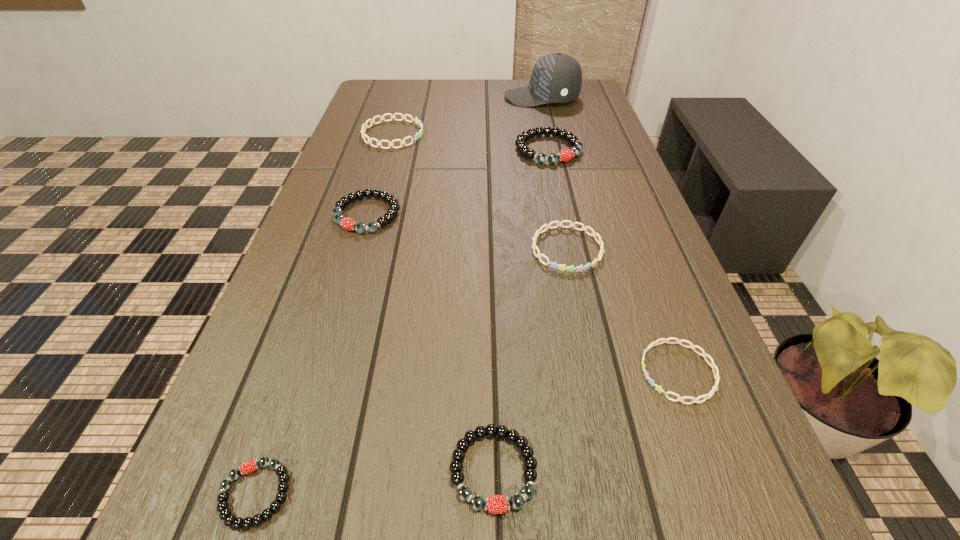
At what (x,y) coordinates should I click in order to perform the action: click on vacant space situated on the surface of the second blue bracelet from right to left showing star-shaped elements. Please return your answer as a coordinate pair (x, y). The width and height of the screenshot is (960, 540). Looking at the image, I should click on (599, 401).

At what (x,y) coordinates should I click in order to perform the action: click on free space located 0.270m on the back of the fourth bracelet from left to right. Please return your answer as a coordinate pair (x, y). The height and width of the screenshot is (540, 960). Looking at the image, I should click on (490, 293).

Identify the location of free space located on the surface of the nearest blue bracelet showing star-shaped elements. The image size is (960, 540). (499, 372).

Locate an element on the screen. The width and height of the screenshot is (960, 540). free spot located 0.320m on the surface of the nearest blue bracelet showing star-shaped elements is located at coordinates (444, 372).

Identify the location of vacant position located on the surface of the nearest blue bracelet showing star-shaped elements. This screenshot has width=960, height=540. (481, 372).

Locate an element on the screen. The width and height of the screenshot is (960, 540). free space located on the right of the smallest black bracelet is located at coordinates (585, 494).

Identify the location of object present at the far edge. (556, 78).

At what (x,y) coordinates should I click in order to perform the action: click on baseball cap at the right edge. Please return your answer as a coordinate pair (x, y). Image resolution: width=960 pixels, height=540 pixels. Looking at the image, I should click on (556, 78).

Image resolution: width=960 pixels, height=540 pixels. I want to click on object present at the far right corner, so click(x=556, y=78).

You are a GUI agent. You are given a task and a screenshot of the screen. Output one action in this format:
    pyautogui.click(x=<x>, y=<y>)
    Task: Click on the vacant space at the far edge
    The width and height of the screenshot is (960, 540).
    Given the screenshot: What is the action you would take?
    pyautogui.click(x=504, y=100)